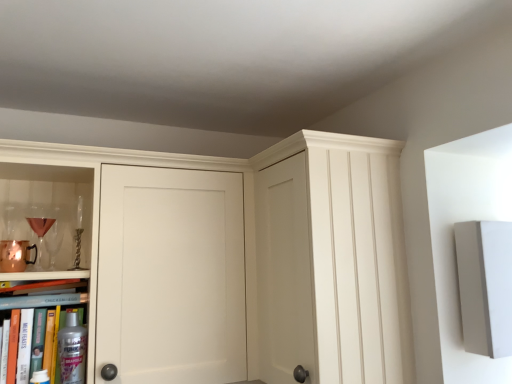
Question: From the image's perspective, is metallic silver spray can at lower left, acting as the first book starting from the bottom, over matte gold wine glass at left, acting as the first wine glass starting from the front?

Choices:
 (A) yes
 (B) no

Answer: (B)

Question: Is metallic silver spray can at lower left, acting as the first book starting from the bottom, smaller than matte gold wine glass at left, arranged as the second wine glass when viewed from the back?

Choices:
 (A) yes
 (B) no

Answer: (B)

Question: Is metallic silver spray can at lower left, positioned as the 2th book in top-to-bottom order, next to matte gold wine glass at left, acting as the first wine glass starting from the front, and touching it?

Choices:
 (A) no
 (B) yes

Answer: (A)

Question: Does metallic silver spray can at lower left, acting as the first book starting from the bottom, appear on the left side of matte gold wine glass at left, acting as the first wine glass starting from the front?

Choices:
 (A) no
 (B) yes

Answer: (A)

Question: Considering the relative sizes of metallic silver spray can at lower left, positioned as the 2th book in top-to-bottom order, and matte gold wine glass at left, arranged as the second wine glass when viewed from the back, in the image provided, is metallic silver spray can at lower left, positioned as the 2th book in top-to-bottom order, thinner than matte gold wine glass at left, arranged as the second wine glass when viewed from the back,?

Choices:
 (A) yes
 (B) no

Answer: (A)

Question: From a real-world perspective, is matte gold wine glass at left, acting as the first wine glass starting from the front, physically located above or below metallic silver spray can at lower left, positioned as the 2th book in top-to-bottom order?

Choices:
 (A) below
 (B) above

Answer: (B)

Question: Looking at their shapes, would you say matte gold wine glass at left, arranged as the second wine glass when viewed from the back, is wider or thinner than metallic silver spray can at lower left, positioned as the 2th book in top-to-bottom order?

Choices:
 (A) wide
 (B) thin

Answer: (A)

Question: Visually, is matte gold wine glass at left, arranged as the second wine glass when viewed from the back, positioned to the left or to the right of metallic silver spray can at lower left, acting as the first book starting from the bottom?

Choices:
 (A) left
 (B) right

Answer: (A)

Question: In terms of height, does matte gold wine glass at left, arranged as the second wine glass when viewed from the back, look taller or shorter compared to metallic silver spray can at lower left, positioned as the 2th book in top-to-bottom order?

Choices:
 (A) tall
 (B) short

Answer: (B)

Question: From the image's perspective, relative to hardcover book at lower left, the first book from the top, is matte gold wine glass at left, arranged as the second wine glass when viewed from the back, above or below?

Choices:
 (A) above
 (B) below

Answer: (A)

Question: Is matte gold wine glass at left, arranged as the second wine glass when viewed from the back, to the left or to the right of hardcover book at lower left, placed as the second book when sorted from bottom to top, in the image?

Choices:
 (A) right
 (B) left

Answer: (B)

Question: From a real-world perspective, relative to hardcover book at lower left, placed as the second book when sorted from bottom to top, is matte gold wine glass at left, arranged as the second wine glass when viewed from the back, vertically above or below?

Choices:
 (A) above
 (B) below

Answer: (A)

Question: Is matte gold wine glass at left, acting as the first wine glass starting from the front, in front of or behind hardcover book at lower left, the first book from the top, in the image?

Choices:
 (A) front
 (B) behind

Answer: (B)

Question: Does point [47, 243] appear closer or farther from the camera than point [81, 377]?

Choices:
 (A) closer
 (B) farther

Answer: (B)

Question: In terms of width, does clear glass wine glass at left, which appears as the 1th wine glass when viewed from the back, look wider or thinner when compared to satin silver spray at lower left?

Choices:
 (A) wide
 (B) thin

Answer: (A)